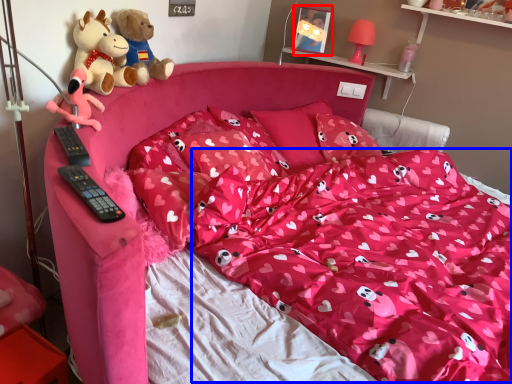
Question: Which point is further to the camera, picture frame (highlighted by a red box) or blanket (highlighted by a blue box)?

Choices:
 (A) picture frame
 (B) blanket

Answer: (A)